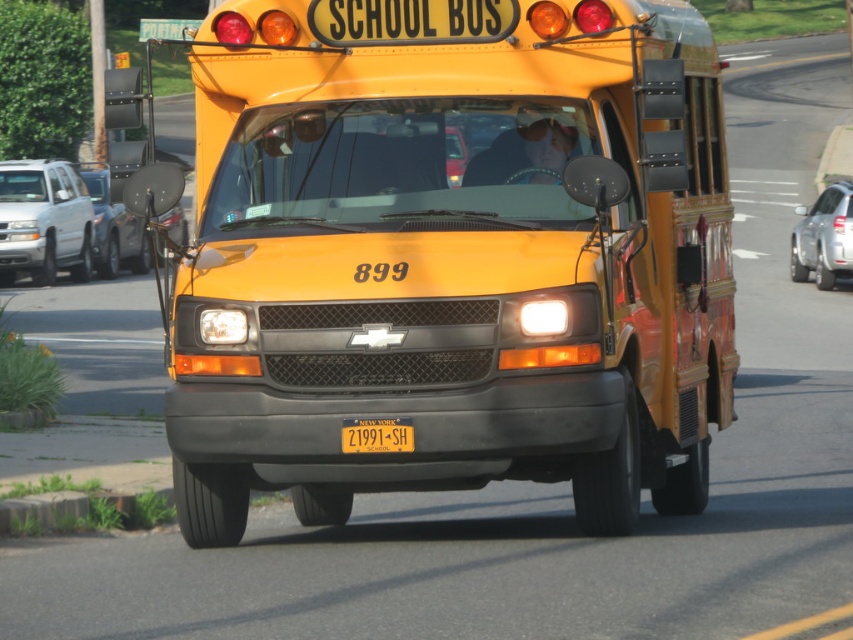
You are standing at the point marked as point (51, 166). The yellow school bus is approaching you on the road. If the bus is currently 98.98 feet away from you, will it pass you safely without coming closer than 100 feet?

The point (51, 166) and viewer are 98.98 feet apart, so the bus is already closer than 100 feet. Therefore, it will not pass safely without coming closer than 100 feet.

You are a traffic officer observing the road. You see a satin silver car at right and a metallic silver car at left. Which car appears to be closer to the camera based on their sizes?

The satin silver car at right is smaller than the metallic silver car at left, so it appears farther away and the metallic silver car at left is closer to the camera.